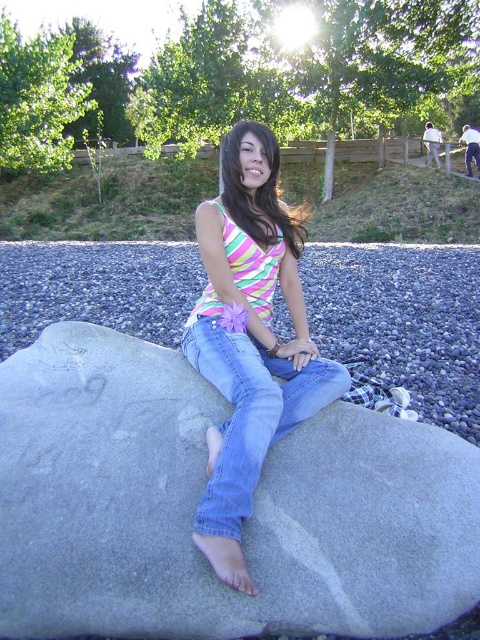
Question: Is striped fabric tank top at center wider than denim jeans at center?

Choices:
 (A) yes
 (B) no

Answer: (A)

Question: Is striped fabric tank top at center above denim jeans at center?

Choices:
 (A) yes
 (B) no

Answer: (A)

Question: Which point appears farthest from the camera in this image?

Choices:
 (A) (236, 372)
 (B) (106, 445)
 (C) (262, 188)

Answer: (C)

Question: Can you confirm if gray smooth boulder at center is positioned to the left of denim jeans at center?

Choices:
 (A) yes
 (B) no

Answer: (A)

Question: Which of the following is the farthest from the observer?

Choices:
 (A) gray smooth boulder at center
 (B) denim jeans at center
 (C) striped fabric tank top at center

Answer: (A)

Question: Which point is closer to the camera?

Choices:
 (A) gray smooth boulder at center
 (B) denim jeans at center
 (C) striped fabric tank top at center

Answer: (C)